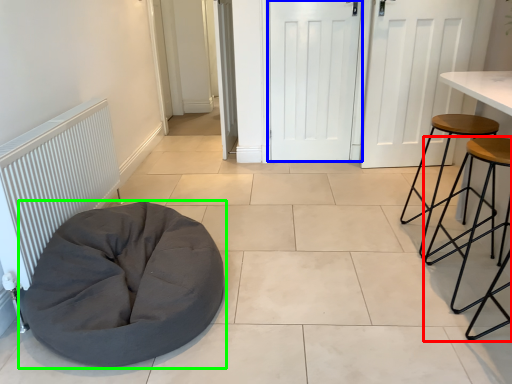
Question: Which is nearer to the stool (highlighted by a red box)? door (highlighted by a blue box) or furniture (highlighted by a green box).

Choices:
 (A) door
 (B) furniture

Answer: (B)